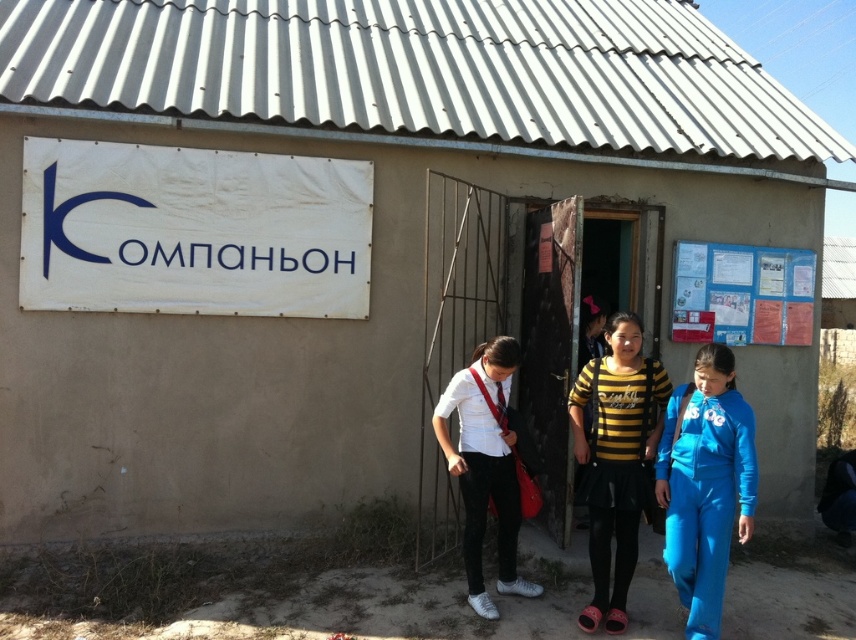
Question: Is white matte shirt at center wider than blue paperboard at upper right?

Choices:
 (A) yes
 (B) no

Answer: (B)

Question: Which point is farther from the camera taking this photo?

Choices:
 (A) (712, 408)
 (B) (223, 300)
 (C) (750, 308)

Answer: (C)

Question: Which object appears closest to the camera in this image?

Choices:
 (A) yellow black striped shirt at center
 (B) blue fleece tracksuit at lower right

Answer: (B)

Question: Estimate the real-world distances between objects in this image. Which object is closer to the white fabric sign at upper left?

Choices:
 (A) yellow black striped shirt at center
 (B) blue fleece tracksuit at lower right

Answer: (A)

Question: Does white matte shirt at center appear under blue paperboard at upper right?

Choices:
 (A) no
 (B) yes

Answer: (B)

Question: Does white fabric sign at upper left have a lesser width compared to yellow black striped shirt at center?

Choices:
 (A) no
 (B) yes

Answer: (A)